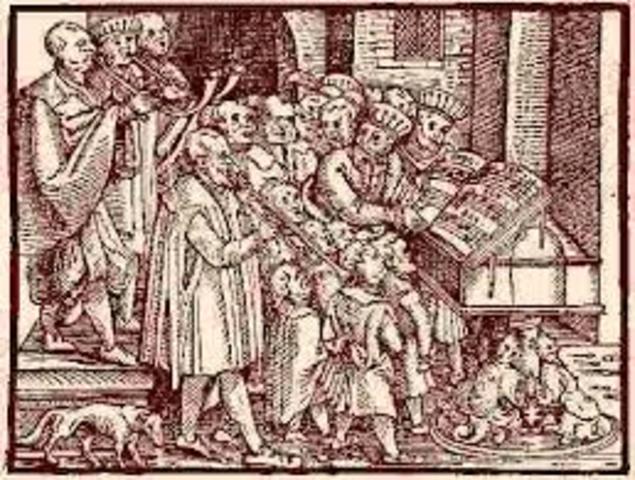
Find the location of `music sheet`. music sheet is located at coordinates (436, 200), (491, 209).